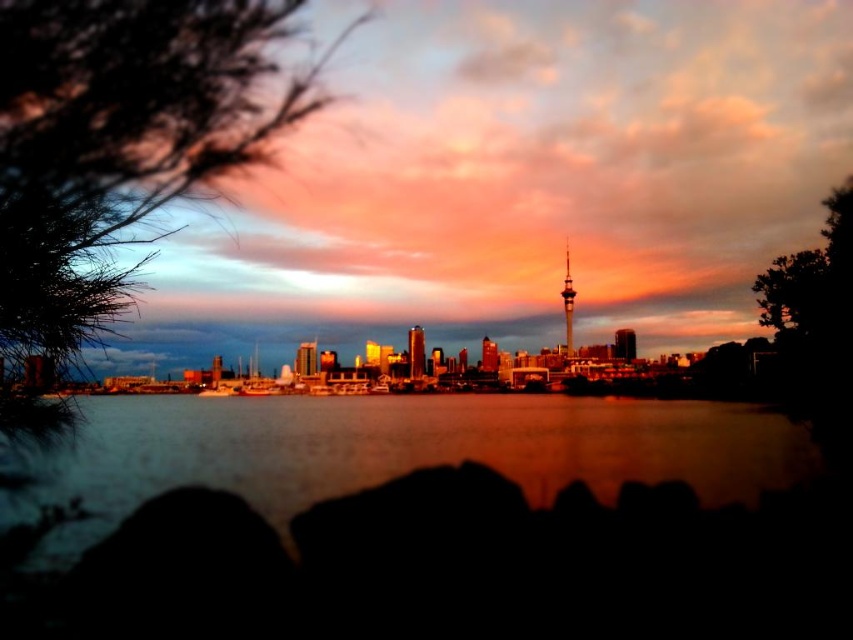
Question: Where is green leafy tree at left located in relation to shiny metallic tv tower at center in the image?

Choices:
 (A) above
 (B) below

Answer: (A)

Question: Which point is farther to the camera?

Choices:
 (A) (828, 408)
 (B) (55, 74)
 (C) (569, 333)

Answer: (C)

Question: Among these objects, which one is farthest from the camera?

Choices:
 (A) green leafy tree at left
 (B) dark green leafy tree at right
 (C) silvery reflective water at center
 (D) shiny metallic tv tower at center

Answer: (D)

Question: Considering the relative positions of green leafy tree at left and dark green leafy tree at right in the image provided, where is green leafy tree at left located with respect to dark green leafy tree at right?

Choices:
 (A) right
 (B) left

Answer: (B)

Question: Which object appears closest to the camera in this image?

Choices:
 (A) green leafy tree at left
 (B) dark green leafy tree at right
 (C) shiny metallic tv tower at center
 (D) silvery reflective water at center

Answer: (A)

Question: Is green leafy tree at left below silvery reflective water at center?

Choices:
 (A) no
 (B) yes

Answer: (A)